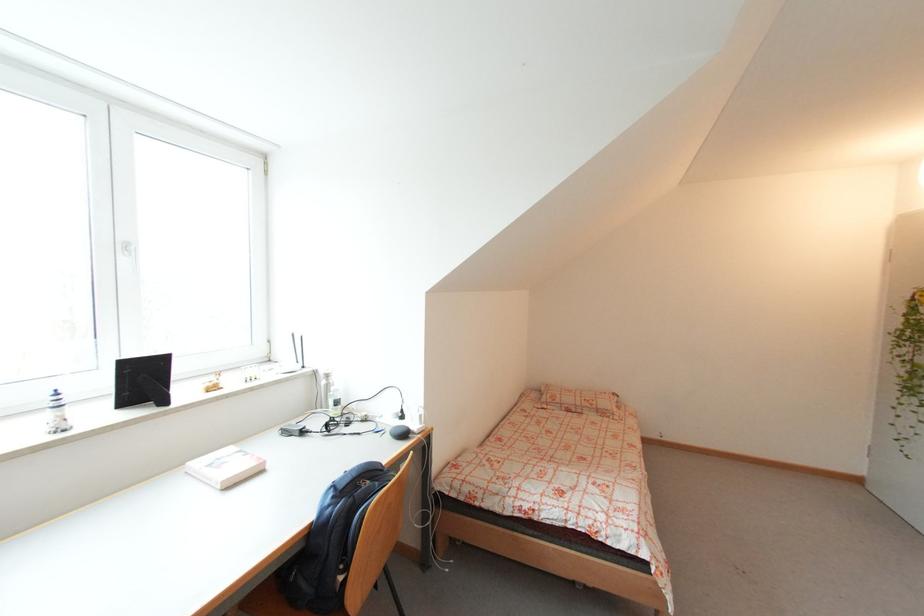
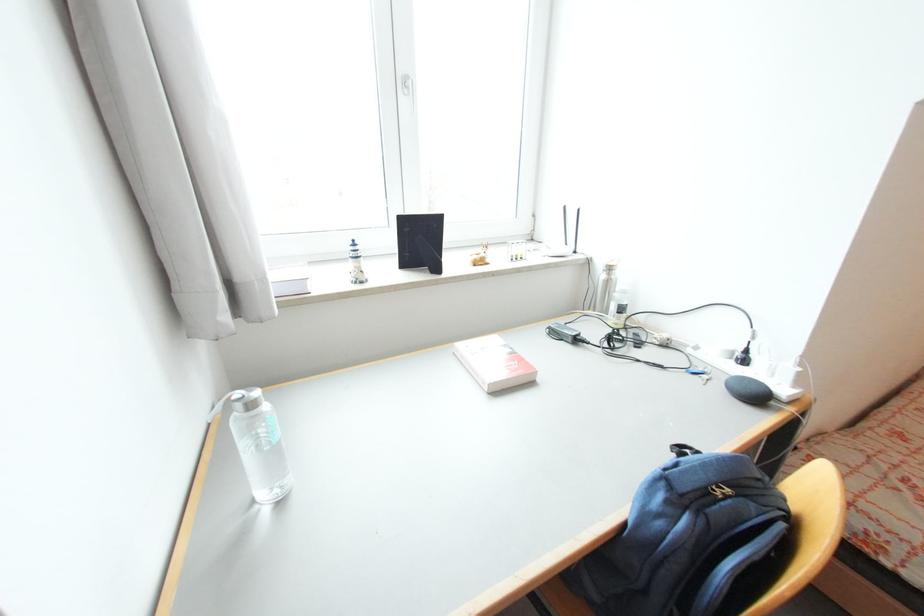
Locate, in the second image, the point that corresponds to [226,483] in the first image.

(493, 386)